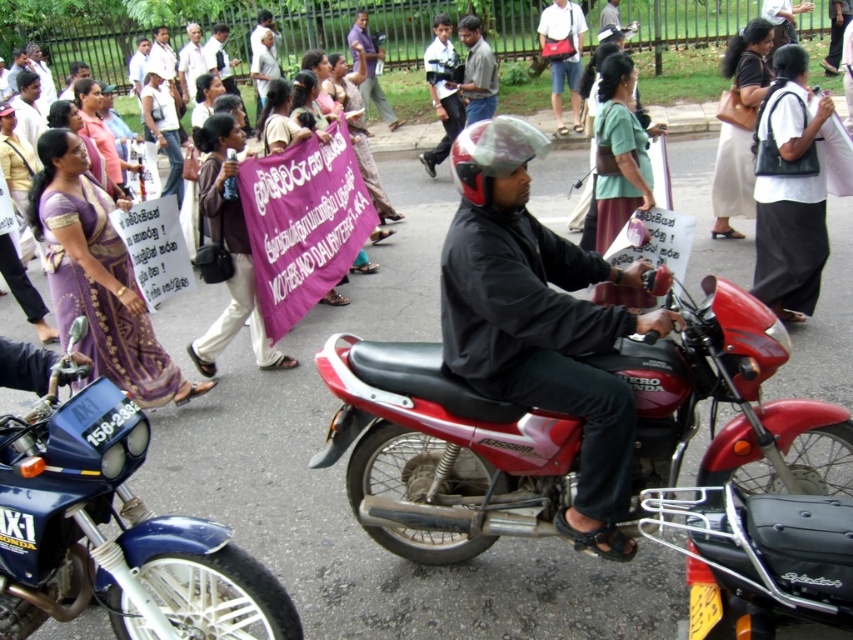
You are a delivery person needing to pass between the blue metallic motorcycle at lower left and the matte black helmet at center. Can your 1.2 meter wide delivery cart fit through the space between them?

The blue metallic motorcycle at lower left is wider than the matte black helmet at center. However, the exact width difference isn not specified, so it is uncertain if the 1.2 meter wide delivery cart can fit through the space between them.

You are a pedestrian standing on the sidewalk and see the red matte motorcycle at center and the matte black helmet at center. Which object is closer to the left side of the image?

The matte black helmet at center is closer to the left side of the image because the red matte motorcycle at center is to the right of it.

You are a pedestrian standing on the sidewalk and see both the red matte motorcycle at center and the blue metallic motorcycle at lower left. Which motorcycle is closer to you?

The red matte motorcycle at center is closer to you because it is positioned further to the viewer than the blue metallic motorcycle at lower left.